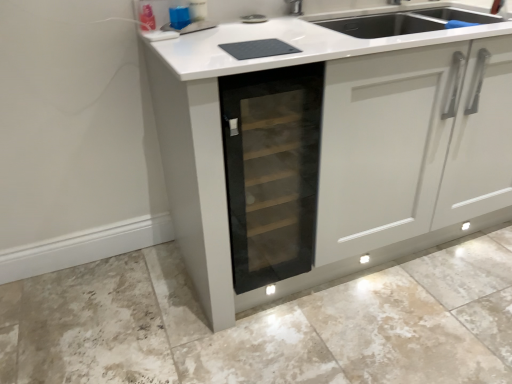
Question: Is matte gray granite at lower center aimed at transparent glass wine cooler at center?

Choices:
 (A) no
 (B) yes

Answer: (A)

Question: Is matte gray granite at lower center not near transparent glass wine cooler at center?

Choices:
 (A) no
 (B) yes

Answer: (A)

Question: Is matte gray granite at lower center positioned beyond the bounds of transparent glass wine cooler at center?

Choices:
 (A) yes
 (B) no

Answer: (A)

Question: Does matte gray granite at lower center have a lesser height compared to transparent glass wine cooler at center?

Choices:
 (A) yes
 (B) no

Answer: (A)

Question: Considering the relative positions of matte gray granite at lower center and transparent glass wine cooler at center in the image provided, is matte gray granite at lower center behind transparent glass wine cooler at center?

Choices:
 (A) yes
 (B) no

Answer: (B)

Question: From the image's perspective, is matte gray granite at lower center located above transparent glass wine cooler at center?

Choices:
 (A) no
 (B) yes

Answer: (A)

Question: Could you tell me if transparent glass wine cooler at center is facing matte gray granite at lower center?

Choices:
 (A) no
 (B) yes

Answer: (A)

Question: Is transparent glass wine cooler at center closer to the viewer compared to matte gray granite at lower center?

Choices:
 (A) no
 (B) yes

Answer: (A)

Question: Considering the relative sizes of transparent glass wine cooler at center and matte gray granite at lower center in the image provided, is transparent glass wine cooler at center smaller than matte gray granite at lower center?

Choices:
 (A) no
 (B) yes

Answer: (B)

Question: Considering the relative sizes of transparent glass wine cooler at center and matte gray granite at lower center in the image provided, is transparent glass wine cooler at center taller than matte gray granite at lower center?

Choices:
 (A) no
 (B) yes

Answer: (B)

Question: From the image's perspective, is transparent glass wine cooler at center located above matte gray granite at lower center?

Choices:
 (A) no
 (B) yes

Answer: (B)

Question: From the image's perspective, is transparent glass wine cooler at center beneath matte gray granite at lower center?

Choices:
 (A) yes
 (B) no

Answer: (B)

Question: Based on their sizes in the image, would you say matte gray granite at lower center is bigger or smaller than transparent glass wine cooler at center?

Choices:
 (A) small
 (B) big

Answer: (B)